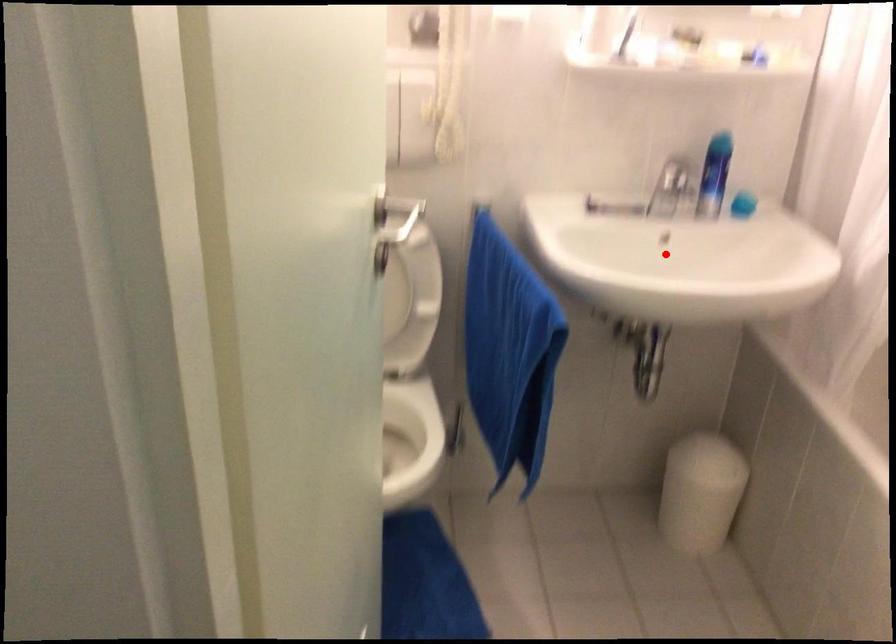
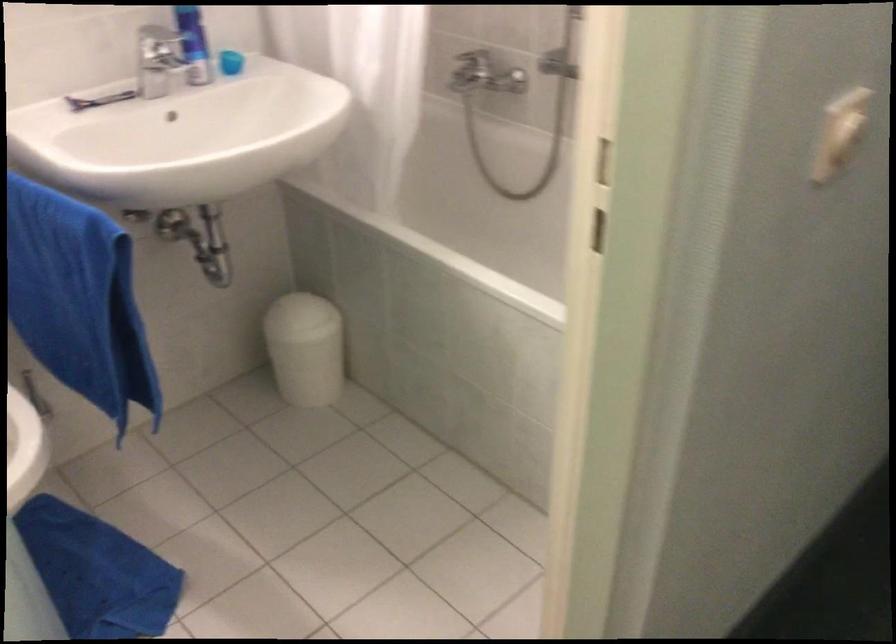
Locate, in the second image, the point that corresponds to the highlighted location in the first image.

(183, 137)